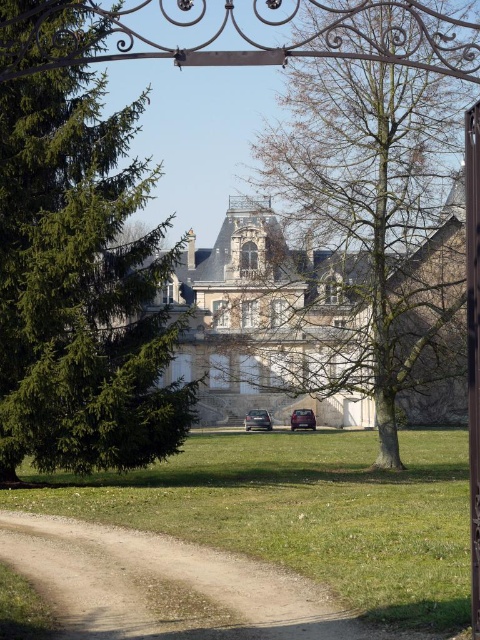
Between metallic gate at center and satin black car at center, which one appears on the left side from the viewer's perspective?

satin black car at center

Describe the element at coordinates (472, 342) in the screenshot. I see `metallic gate at center` at that location.

Where is `metallic gate at center`? The height and width of the screenshot is (640, 480). metallic gate at center is located at coordinates (472, 342).

Between green matte tree at left and dirt path at lower left, which one appears on the left side from the viewer's perspective?

green matte tree at left is more to the left.

Is point (12, 182) farther from viewer compared to point (84, 602)?

Yes, point (12, 182) is farther from viewer.

Image resolution: width=480 pixels, height=640 pixels. I want to click on green matte tree at left, so click(80, 285).

You are a GUI agent. You are given a task and a screenshot of the screen. Output one action in this format:
    pyautogui.click(x=<x>, y=<y>)
    Task: Click on the green matte tree at left
    This screenshot has height=640, width=480.
    Given the screenshot: What is the action you would take?
    pyautogui.click(x=80, y=285)

Looking at this image, is bare wood tree at center wider than metallic gate at center?

Indeed, bare wood tree at center has a greater width compared to metallic gate at center.

Which is above, bare wood tree at center or metallic gate at center?

bare wood tree at center

Who is more forward, (x=336, y=90) or (x=471, y=196)?

Point (x=471, y=196) is in front.

Locate an element on the screen. bare wood tree at center is located at coordinates (364, 173).